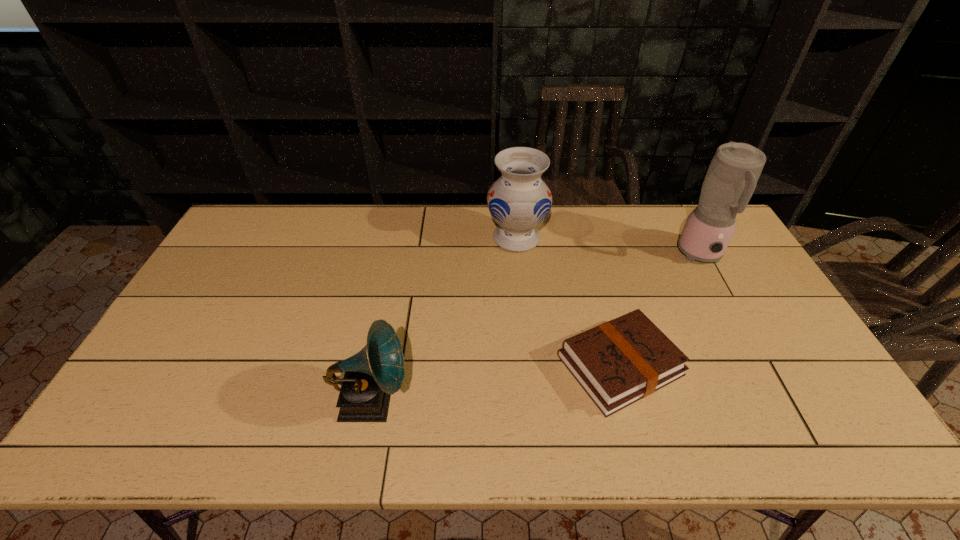
The image size is (960, 540). In order to click on food processor located at the far edge in this screenshot , I will do point(732,176).

Locate an element on the screen. The image size is (960, 540). vase at the far edge is located at coordinates (519, 201).

You are a GUI agent. You are given a task and a screenshot of the screen. Output one action in this format:
    pyautogui.click(x=<x>, y=<y>)
    Task: Click on the phonograph_record situated at the near edge
    This screenshot has height=540, width=960.
    Given the screenshot: What is the action you would take?
    pyautogui.click(x=372, y=375)

Locate an element on the screen. hardback book that is at the near edge is located at coordinates (621, 361).

Identify the location of object located in the right edge section of the desktop. The width and height of the screenshot is (960, 540). pyautogui.click(x=732, y=176).

Where is `object that is at the far right corner`? The image size is (960, 540). object that is at the far right corner is located at coordinates (732, 176).

Find the location of a particular element. Image resolution: width=960 pixels, height=540 pixels. vacant area at the far edge of the desktop is located at coordinates (482, 234).

Where is `vacant space at the near edge`? Image resolution: width=960 pixels, height=540 pixels. vacant space at the near edge is located at coordinates (458, 434).

Identify the location of vacant space at the left edge of the desktop. The width and height of the screenshot is (960, 540). (220, 251).

In order to click on free space at the right edge of the desktop in this screenshot , I will do `click(750, 292)`.